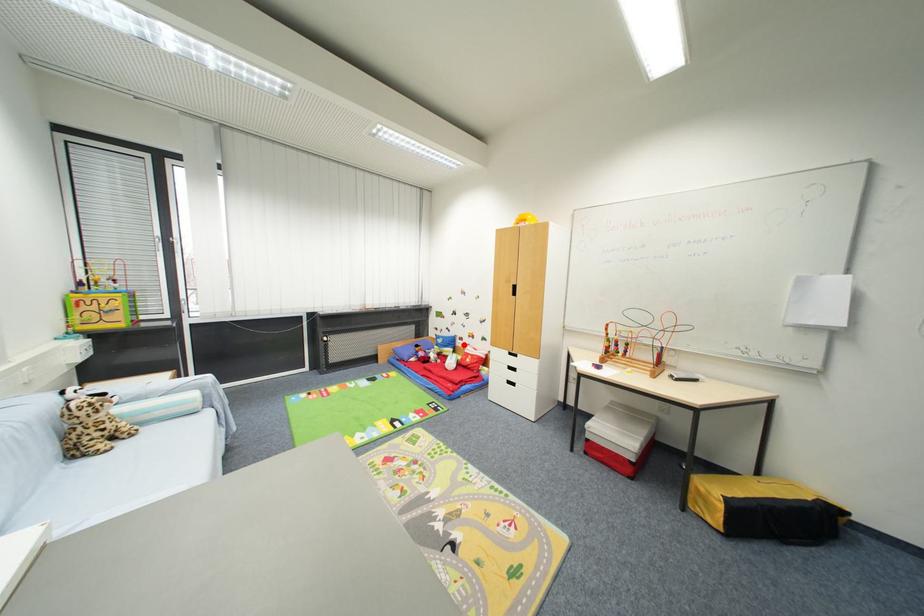
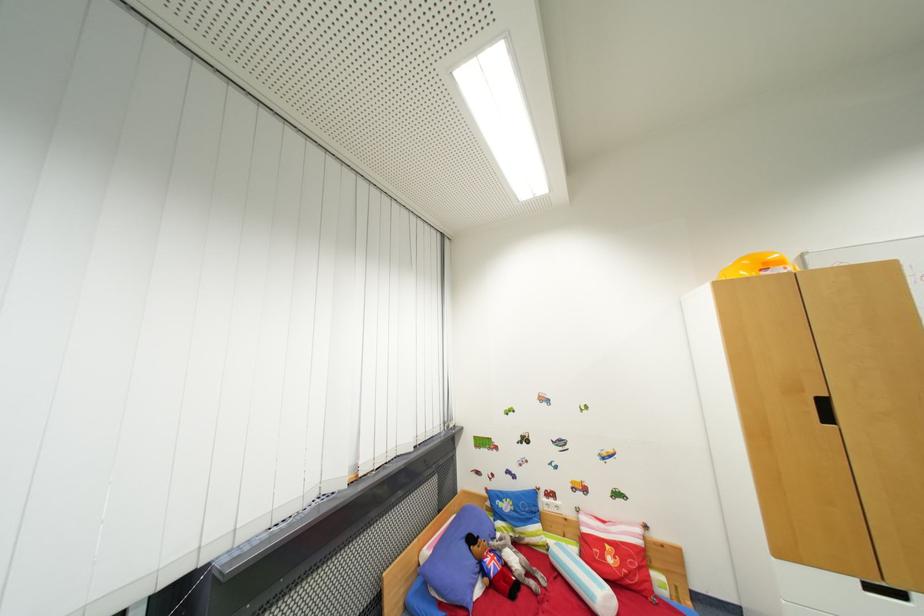
Question: I am providing you with two images of the same scene from different viewpoints. A red point is marked on the first image. Is the red point's position out of view in image 2?

Choices:
 (A) Yes
 (B) No

Answer: (B)